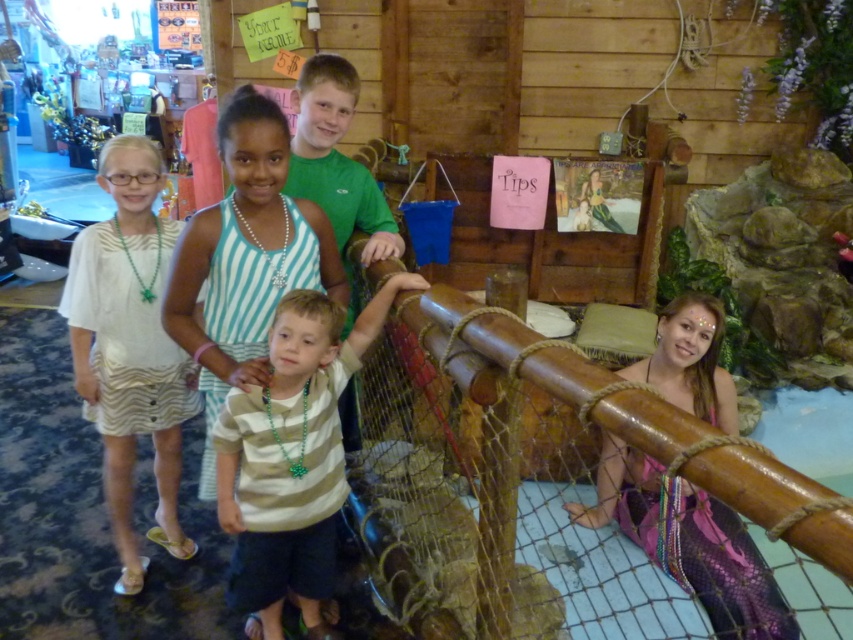
Who is higher up, wooden at upper center or striped cotton shirt at center?

striped cotton shirt at center is higher up.

Can you confirm if wooden at upper center is thinner than striped cotton shirt at center?

No.

Identify the location of wooden at upper center. This screenshot has width=853, height=640. (508, 484).

Consider the image. Who is higher up, striped cotton shirt at center or white striped dress at left?

white striped dress at left is above.

Looking at this image, who is more forward, (224,429) or (134,406)?

Point (224,429) is in front.

I want to click on striped cotton shirt at center, so point(292,454).

Does wooden at upper center have a larger size compared to white striped dress at left?

Yes, wooden at upper center is bigger than white striped dress at left.

Between wooden at upper center and white striped dress at left, which one is positioned lower?

wooden at upper center is below.

The image size is (853, 640). Describe the element at coordinates (508, 484) in the screenshot. I see `wooden at upper center` at that location.

You are a GUI agent. You are given a task and a screenshot of the screen. Output one action in this format:
    pyautogui.click(x=<x>, y=<y>)
    Task: Click on the wooden at upper center
    
    Given the screenshot: What is the action you would take?
    pyautogui.click(x=508, y=484)